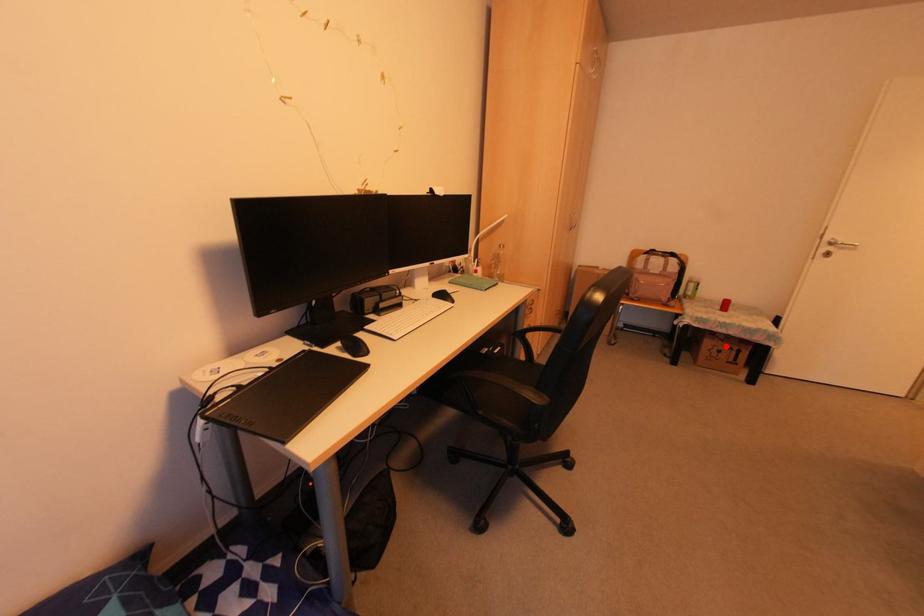
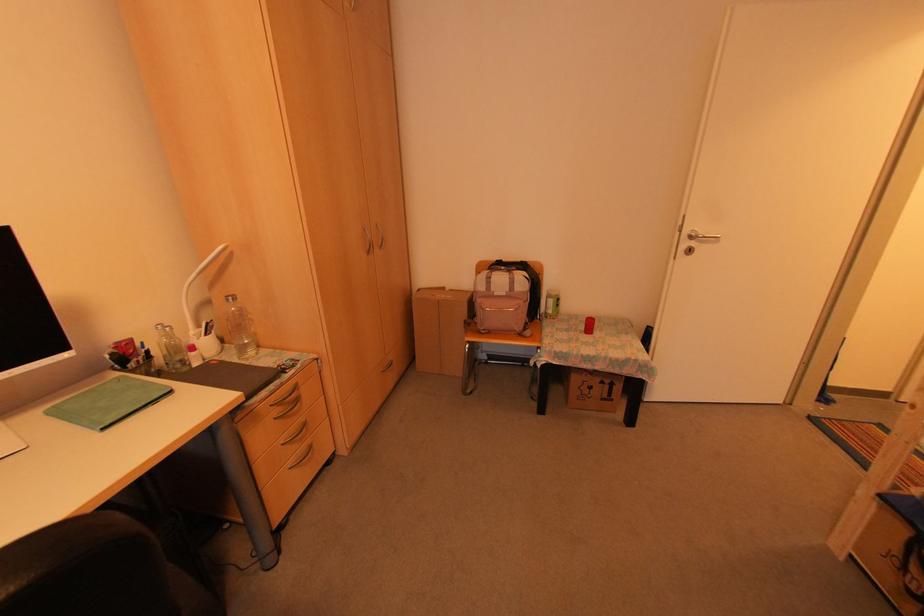
Question: I am providing you with two images of the same scene from different viewpoints. A red point is shown in image1. For the corresponding object point in image2, is it positioned nearer or farther from the camera?

Choices:
 (A) Nearer
 (B) Farther

Answer: (B)